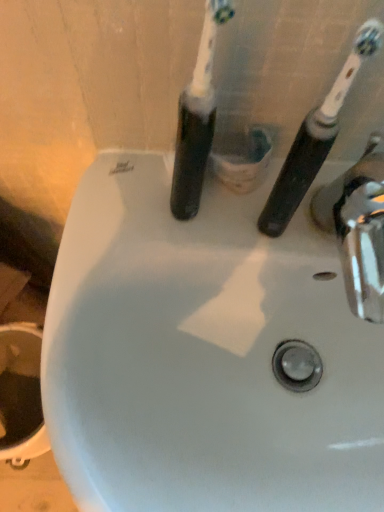
This screenshot has height=512, width=384. Find the location of `chrome metallic tap at right`. chrome metallic tap at right is located at coordinates (358, 229).

Locate an element on the screen. This screenshot has height=512, width=384. black rubber toothbrush at upper right, which appears as the first toothbrush when viewed from the right is located at coordinates (315, 138).

What's the angular difference between black plastic toothbrush at center, arranged as the 2th toothbrush when viewed from the right, and black rubber toothbrush at upper right, which is the 2th toothbrush in left-to-right order,'s facing directions?

black plastic toothbrush at center, arranged as the 2th toothbrush when viewed from the right, and black rubber toothbrush at upper right, which is the 2th toothbrush in left-to-right order, are facing 6.71 degrees away from each other.

Is black plastic toothbrush at center, arranged as the 2th toothbrush when viewed from the right, outside of black rubber toothbrush at upper right, which is the 2th toothbrush in left-to-right order?

black plastic toothbrush at center, arranged as the 2th toothbrush when viewed from the right, lies outside black rubber toothbrush at upper right, which is the 2th toothbrush in left-to-right order,'s area.

In terms of size, does black plastic toothbrush at center, placed as the first toothbrush when sorted from left to right, appear bigger or smaller than black rubber toothbrush at upper right, which appears as the first toothbrush when viewed from the right?

black plastic toothbrush at center, placed as the first toothbrush when sorted from left to right, is bigger than black rubber toothbrush at upper right, which appears as the first toothbrush when viewed from the right.

Is the depth of black plastic toothbrush at center, arranged as the 2th toothbrush when viewed from the right, less than that of black rubber toothbrush at upper right, which is the 2th toothbrush in left-to-right order?

Yes, the depth of black plastic toothbrush at center, arranged as the 2th toothbrush when viewed from the right, is less than that of black rubber toothbrush at upper right, which is the 2th toothbrush in left-to-right order.

In terms of height, does black rubber toothbrush at upper right, which appears as the first toothbrush when viewed from the right, look taller or shorter compared to black plastic toothbrush at center, placed as the first toothbrush when sorted from left to right?

black rubber toothbrush at upper right, which appears as the first toothbrush when viewed from the right, is shorter than black plastic toothbrush at center, placed as the first toothbrush when sorted from left to right.

Between black rubber toothbrush at upper right, which appears as the first toothbrush when viewed from the right, and black plastic toothbrush at center, placed as the first toothbrush when sorted from left to right, which one appears on the right side from the viewer's perspective?

black rubber toothbrush at upper right, which appears as the first toothbrush when viewed from the right, is more to the right.

From a real-world perspective, is black rubber toothbrush at upper right, which is the 2th toothbrush in left-to-right order, positioned above or below black plastic toothbrush at center, arranged as the 2th toothbrush when viewed from the right?

From a real-world perspective, black rubber toothbrush at upper right, which is the 2th toothbrush in left-to-right order, is physically below black plastic toothbrush at center, arranged as the 2th toothbrush when viewed from the right.

Considering the sizes of black rubber toothbrush at upper right, which is the 2th toothbrush in left-to-right order, and black plastic toothbrush at center, placed as the first toothbrush when sorted from left to right, in the image, is black rubber toothbrush at upper right, which is the 2th toothbrush in left-to-right order, wider or thinner than black plastic toothbrush at center, placed as the first toothbrush when sorted from left to right,?

Considering their sizes, black rubber toothbrush at upper right, which is the 2th toothbrush in left-to-right order, looks slimmer than black plastic toothbrush at center, placed as the first toothbrush when sorted from left to right.

Can we say chrome metallic tap at right lies outside black rubber toothbrush at upper right, which is the 2th toothbrush in left-to-right order?

Yes, chrome metallic tap at right is located beyond the bounds of black rubber toothbrush at upper right, which is the 2th toothbrush in left-to-right order.

Between chrome metallic tap at right and black rubber toothbrush at upper right, which is the 2th toothbrush in left-to-right order, which one appears on the left side from the viewer's perspective?

black rubber toothbrush at upper right, which is the 2th toothbrush in left-to-right order, is more to the left.

Considering the positions of objects chrome metallic tap at right and black rubber toothbrush at upper right, which is the 2th toothbrush in left-to-right order, in the image provided, who is behind, chrome metallic tap at right or black rubber toothbrush at upper right, which is the 2th toothbrush in left-to-right order,?

chrome metallic tap at right is further from the camera.

Where is `tap located underneath the black rubber toothbrush at upper right, which is the 2th toothbrush in left-to-right order (from a real-world perspective)`? tap located underneath the black rubber toothbrush at upper right, which is the 2th toothbrush in left-to-right order (from a real-world perspective) is located at coordinates (358, 229).

Does black plastic toothbrush at center, arranged as the 2th toothbrush when viewed from the right, have a smaller size compared to chrome metallic tap at right?

Yes, black plastic toothbrush at center, arranged as the 2th toothbrush when viewed from the right, is smaller than chrome metallic tap at right.

Is chrome metallic tap at right at the back of black plastic toothbrush at center, placed as the first toothbrush when sorted from left to right?

No, black plastic toothbrush at center, placed as the first toothbrush when sorted from left to right, is not facing the opposite direction of chrome metallic tap at right.

Consider the image. Can you confirm if black plastic toothbrush at center, arranged as the 2th toothbrush when viewed from the right, is positioned to the right of chrome metallic tap at right?

Incorrect, black plastic toothbrush at center, arranged as the 2th toothbrush when viewed from the right, is not on the right side of chrome metallic tap at right.

Who is more distant, black rubber toothbrush at upper right, which appears as the first toothbrush when viewed from the right, or chrome metallic tap at right?

chrome metallic tap at right.

Considering the relative sizes of black rubber toothbrush at upper right, which appears as the first toothbrush when viewed from the right, and chrome metallic tap at right in the image provided, is black rubber toothbrush at upper right, which appears as the first toothbrush when viewed from the right, shorter than chrome metallic tap at right?

No.

Consider the image. From a real-world perspective, which object stands above the other?

black rubber toothbrush at upper right, which is the 2th toothbrush in left-to-right order, from a real-world perspective.

From the picture: Is black rubber toothbrush at upper right, which appears as the first toothbrush when viewed from the right, at the left side of chrome metallic tap at right?

Correct, you'll find black rubber toothbrush at upper right, which appears as the first toothbrush when viewed from the right, to the left of chrome metallic tap at right.

From a real-world perspective, which object rests below the other?

chrome metallic tap at right, from a real-world perspective.

Is chrome metallic tap at right wider than black plastic toothbrush at center, placed as the first toothbrush when sorted from left to right?

Indeed, chrome metallic tap at right has a greater width compared to black plastic toothbrush at center, placed as the first toothbrush when sorted from left to right.

Is chrome metallic tap at right at the right side of black plastic toothbrush at center, placed as the first toothbrush when sorted from left to right?

Correct, you'll find chrome metallic tap at right to the right of black plastic toothbrush at center, placed as the first toothbrush when sorted from left to right.

The height and width of the screenshot is (512, 384). What are the coordinates of `toothbrush that appears below the black plastic toothbrush at center, arranged as the 2th toothbrush when viewed from the right (from a real-world perspective)` in the screenshot? It's located at (315, 138).

Image resolution: width=384 pixels, height=512 pixels. In order to click on toothbrush lying on the right of black plastic toothbrush at center, arranged as the 2th toothbrush when viewed from the right in this screenshot , I will do `click(315, 138)`.

From the image, which object appears to be nearer to black rubber toothbrush at upper right, which is the 2th toothbrush in left-to-right order, black plastic toothbrush at center, arranged as the 2th toothbrush when viewed from the right, or chrome metallic tap at right?

Based on the image, chrome metallic tap at right appears to be nearer to black rubber toothbrush at upper right, which is the 2th toothbrush in left-to-right order.

Consider the image. From the image, which object appears to be farther from black plastic toothbrush at center, placed as the first toothbrush when sorted from left to right, chrome metallic tap at right or black rubber toothbrush at upper right, which is the 2th toothbrush in left-to-right order?

Among the two, chrome metallic tap at right is located further to black plastic toothbrush at center, placed as the first toothbrush when sorted from left to right.

From the image, which object appears to be farther from chrome metallic tap at right, black plastic toothbrush at center, placed as the first toothbrush when sorted from left to right, or black rubber toothbrush at upper right, which appears as the first toothbrush when viewed from the right?

black plastic toothbrush at center, placed as the first toothbrush when sorted from left to right.

Based on their spatial positions, is black rubber toothbrush at upper right, which is the 2th toothbrush in left-to-right order, or black plastic toothbrush at center, placed as the first toothbrush when sorted from left to right, closer to chrome metallic tap at right?

The object closer to chrome metallic tap at right is black rubber toothbrush at upper right, which is the 2th toothbrush in left-to-right order.

Estimate the real-world distances between objects in this image. Which object is closer to black plastic toothbrush at center, arranged as the 2th toothbrush when viewed from the right, black rubber toothbrush at upper right, which is the 2th toothbrush in left-to-right order, or chrome metallic tap at right?

Among the two, black rubber toothbrush at upper right, which is the 2th toothbrush in left-to-right order, is located nearer to black plastic toothbrush at center, arranged as the 2th toothbrush when viewed from the right.

Considering their positions, is chrome metallic tap at right positioned further to black rubber toothbrush at upper right, which is the 2th toothbrush in left-to-right order, than black plastic toothbrush at center, arranged as the 2th toothbrush when viewed from the right?

black plastic toothbrush at center, arranged as the 2th toothbrush when viewed from the right, is further to black rubber toothbrush at upper right, which is the 2th toothbrush in left-to-right order.

Find the location of a particular element. toothbrush between black plastic toothbrush at center, placed as the first toothbrush when sorted from left to right, and chrome metallic tap at right, in the horizontal direction is located at coordinates (315, 138).